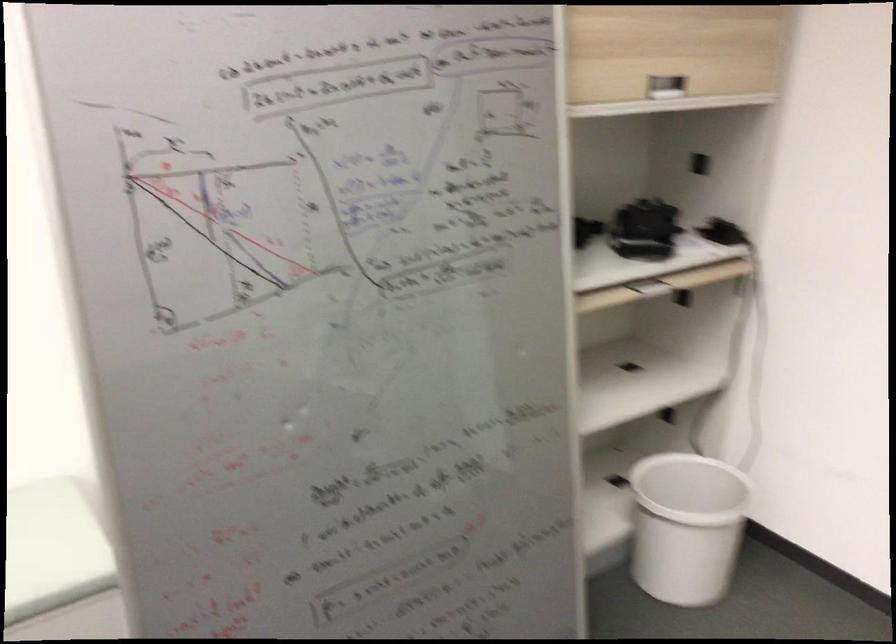
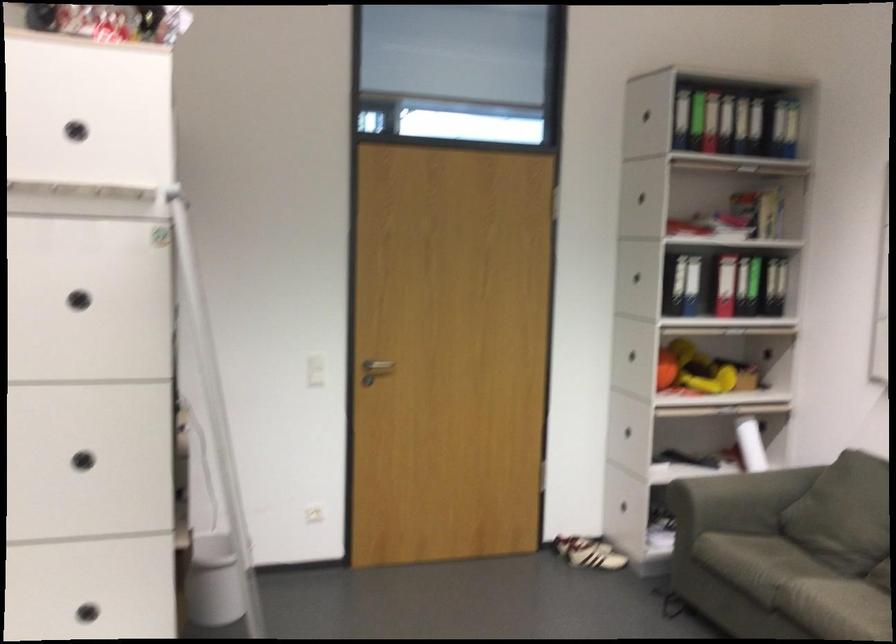
In the second image, find the point that corresponds to point 174,468 in the first image.

(96, 598)